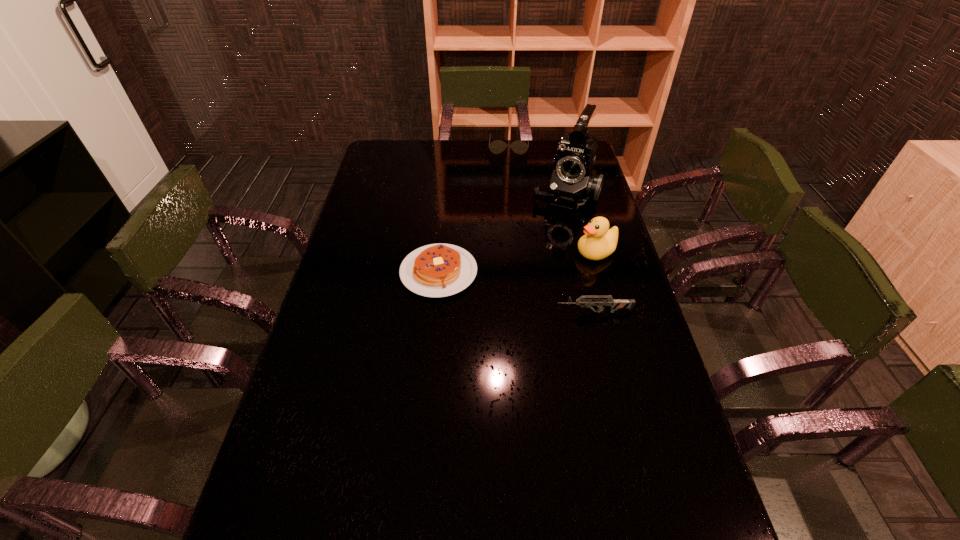
This screenshot has width=960, height=540. In order to click on free spot on the desktop that is between the leftmost object and the nearest object and is positioned at the beak of the duck in this screenshot , I will do `click(499, 288)`.

Locate an element on the screen. vacant space on the desktop that is between the shortest object and the nearest object and is positioned on the lens mount of the tallest object is located at coordinates (517, 292).

Locate an element on the screen. vacant spot on the desktop that is between the shortest object and the gun and is positioned on the front-facing side of the sunglasses is located at coordinates (497, 287).